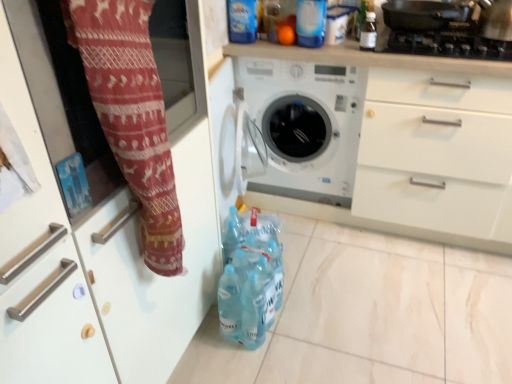
Where is `free spot in front of translucent plastic bottles at lower center, placed as the first bottle when sorted from bottom to top`? free spot in front of translucent plastic bottles at lower center, placed as the first bottle when sorted from bottom to top is located at coordinates (261, 365).